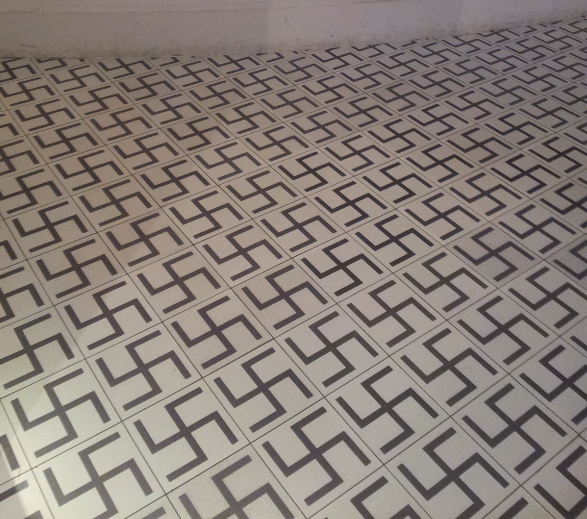
Find the location of a particular element. tile is located at coordinates (541, 242).